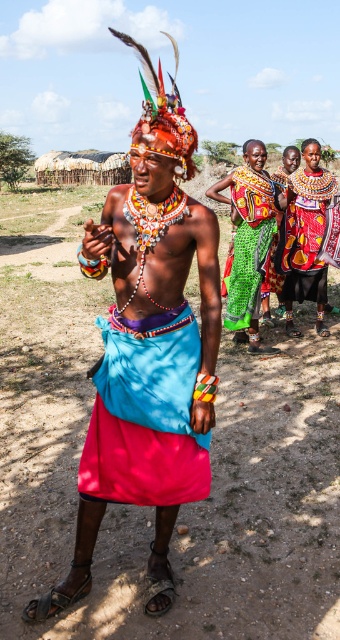
In the scene shown: You are a photographer trying to capture the vibrant scene. You want to ensure that both the shiny multicolored headdress at center and the green woven skirt at center are in focus. Given that your camera can only focus on objects within a 2.5 meter range, will you be able to capture both subjects clearly?

The shiny multicolored headdress at center is 3.24 meters away from the green woven skirt at center. Since the distance between them exceeds the camera focus range of 2.5 meters, you cannot capture both subjects clearly in focus simultaneously.

You are a photographer at the cultural event and want to capture the central figure. Which skirt, the green woven skirt at center or the shiny red skirt at center, is closer to the camera?

The shiny red skirt at center is closer to the camera because the green woven skirt at center is located below it, meaning it is behind the shiny red skirt at center.